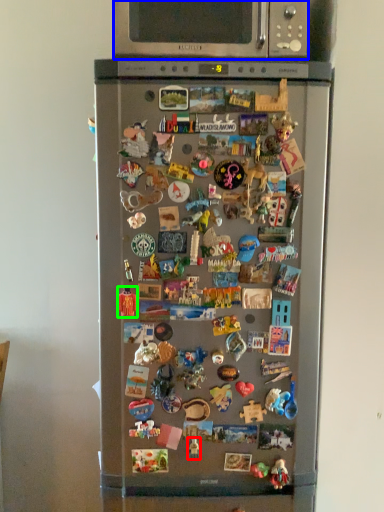
Question: Which is farther away from toy (highlighted by a red box)? microwave oven (highlighted by a blue box) or toy (highlighted by a green box)?

Choices:
 (A) microwave oven
 (B) toy

Answer: (A)